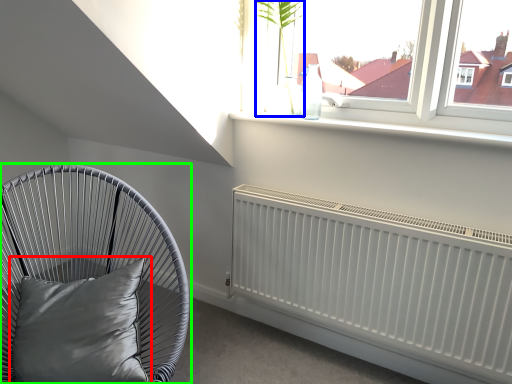
Question: Which object is positioned closest to pillow (highlighted by a red box)? Select from plant (highlighted by a blue box) and furniture (highlighted by a green box).

Choices:
 (A) plant
 (B) furniture

Answer: (B)